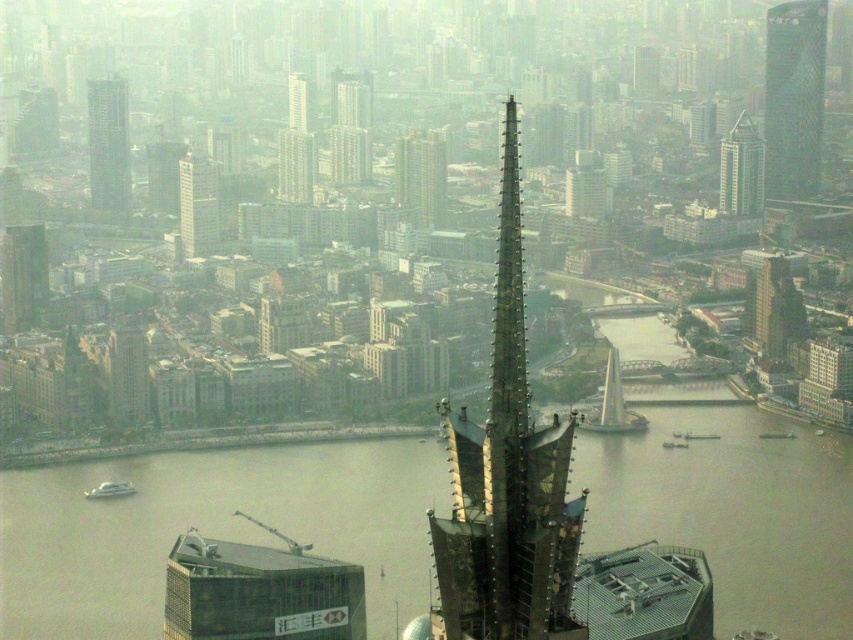
Question: Which point is closer to the camera taking this photo?

Choices:
 (A) (303, 129)
 (B) (730, 205)

Answer: (A)

Question: Can you confirm if brown water at center is positioned above gold metallic building at upper right?

Choices:
 (A) yes
 (B) no

Answer: (B)

Question: Which point is closer to the camera?

Choices:
 (A) (577, 170)
 (B) (537, 556)
 (C) (196, 173)

Answer: (B)

Question: Among these objects, which one is farthest from the camera?

Choices:
 (A) green glass tower at upper right
 (B) metallic glass building at lower left
 (C) smooth glass skyscraper at upper left

Answer: (A)

Question: Does green glass building at upper center have a lesser width compared to metallic gray skyscraper at center?

Choices:
 (A) yes
 (B) no

Answer: (B)

Question: Observing the image, what is the correct spatial positioning of metallic glass building at lower left in reference to metallic gray skyscraper at center?

Choices:
 (A) below
 (B) above

Answer: (A)